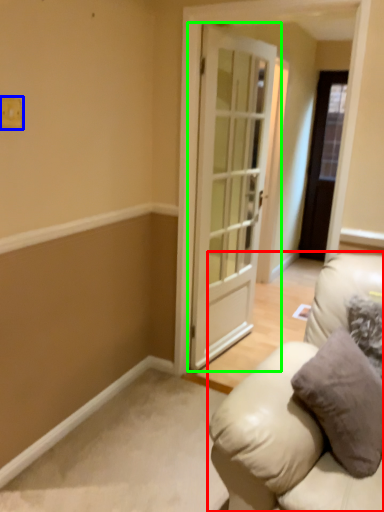
Question: Based on their relative distances, which object is farther from studio couch (highlighted by a red box)? Choose from light switch (highlighted by a blue box) and door (highlighted by a green box).

Choices:
 (A) light switch
 (B) door

Answer: (A)